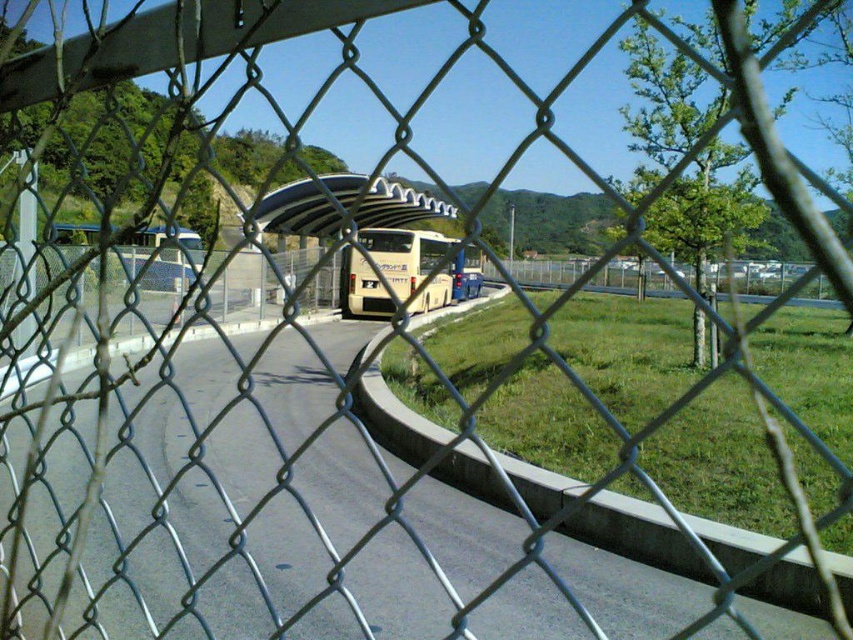
Question: Does beige plastic bus stop at center appear on the right side of beige matte bus at center?

Choices:
 (A) no
 (B) yes

Answer: (A)

Question: Can you confirm if beige plastic bus stop at center is positioned to the right of beige matte bus at center?

Choices:
 (A) no
 (B) yes

Answer: (A)

Question: Among these points, which one is nearest to the camera?

Choices:
 (A) (352, 177)
 (B) (416, 276)

Answer: (B)

Question: Can you confirm if beige plastic bus stop at center is thinner than beige matte bus at center?

Choices:
 (A) no
 (B) yes

Answer: (A)